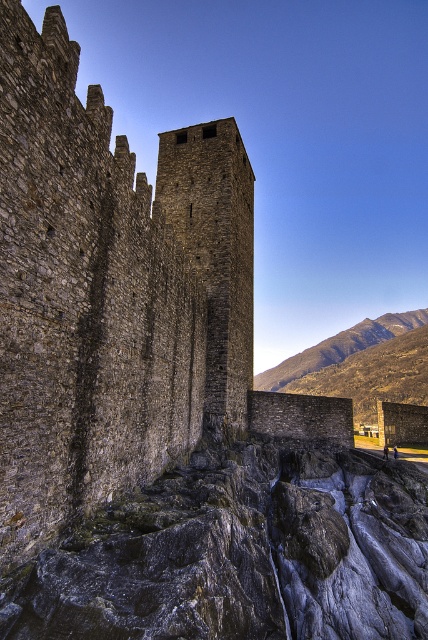
Question: Is gray stone waterfall at lower center below dark gray stone tower at center?

Choices:
 (A) no
 (B) yes

Answer: (B)

Question: Is gray stone waterfall at lower center closer to camera compared to dark gray stone tower at center?

Choices:
 (A) yes
 (B) no

Answer: (A)

Question: Is gray stone waterfall at lower center to the right of dark gray stone tower at center from the viewer's perspective?

Choices:
 (A) no
 (B) yes

Answer: (B)

Question: Which of the following is the farthest from the observer?

Choices:
 (A) (404, 525)
 (B) (187, 237)

Answer: (B)

Question: Which point is closer to the camera?

Choices:
 (A) dark gray stone tower at center
 (B) gray stone waterfall at lower center

Answer: (B)